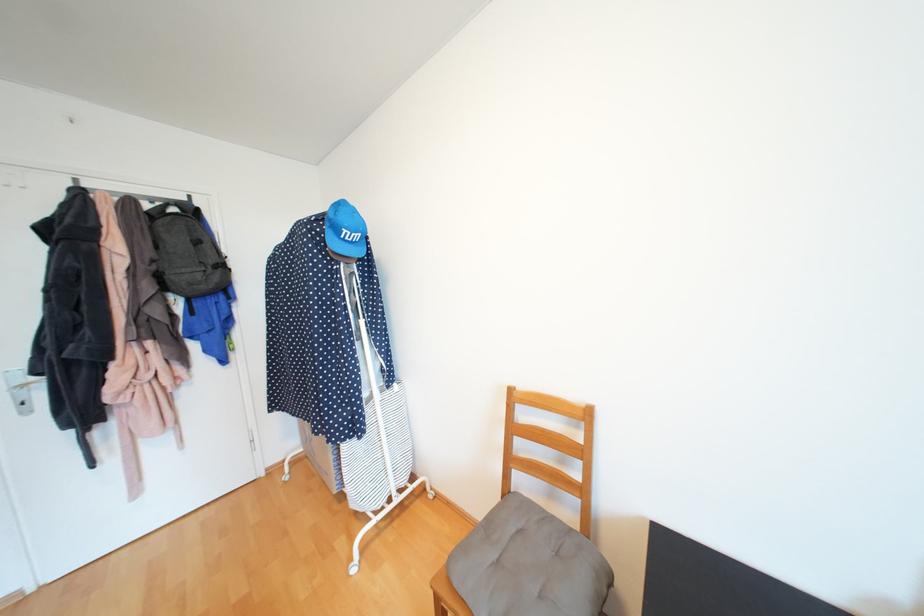
Describe the element at coordinates (187, 252) in the screenshot. This screenshot has height=616, width=924. I see `the striped tote bag` at that location.